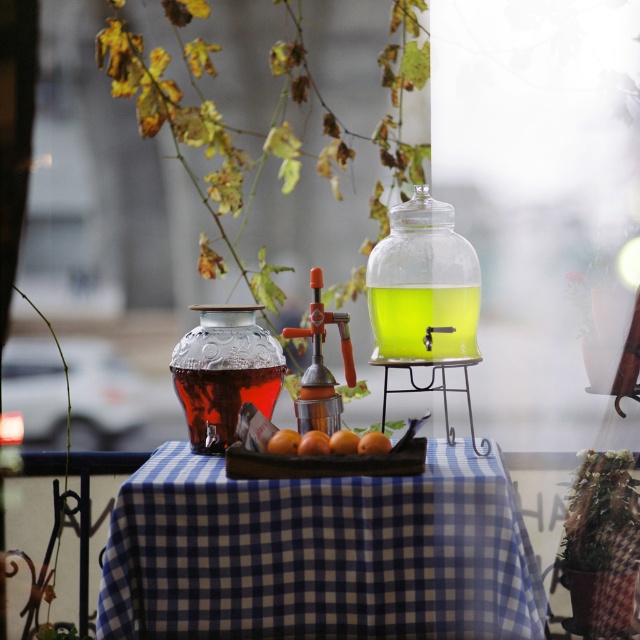
Question: Which point is closer to the camera taking this photo?

Choices:
 (A) (230, 401)
 (B) (346, 451)
 (C) (109, 593)
 (D) (374, 323)

Answer: (C)

Question: Among these points, which one is farthest from the camera?

Choices:
 (A) (372, 307)
 (B) (177, 577)
 (C) (458, 324)

Answer: (A)

Question: Does translucent glass jug at center appear on the right side of smooth orange fruit at center?

Choices:
 (A) yes
 (B) no

Answer: (A)

Question: Is blue checkered tablecloth at center behind translucent glass carafe at center?

Choices:
 (A) no
 (B) yes

Answer: (A)

Question: Is the position of blue checkered tablecloth at center less distant than that of orange matte at center?

Choices:
 (A) no
 (B) yes

Answer: (B)

Question: Estimate the real-world distances between objects in this image. Which object is closer to the orange matte at center?

Choices:
 (A) transparent glass jug at center
 (B) smooth orange fruit at center

Answer: (B)